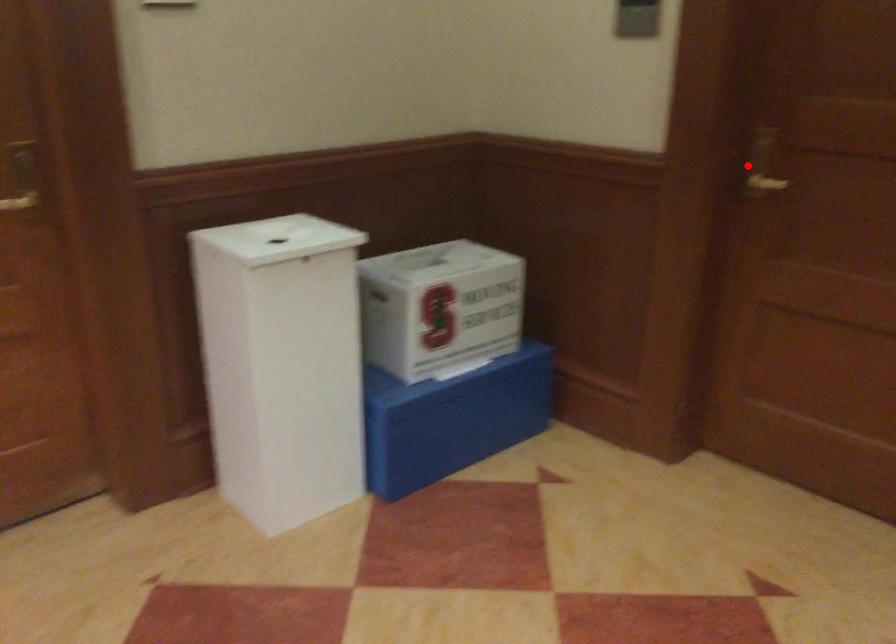
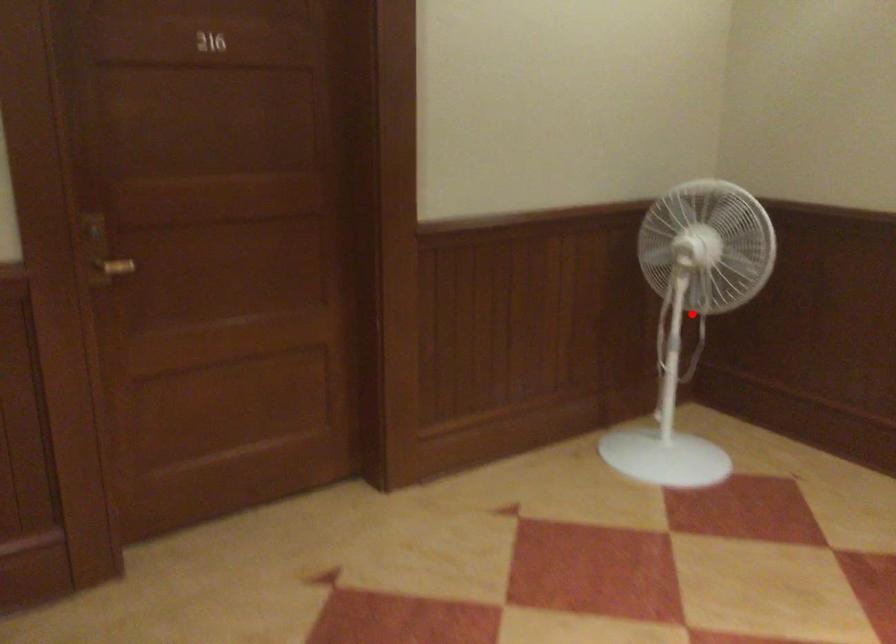
I am providing you with two images of the same scene from different viewpoints. A red point is marked on the first image and another point is marked on the second image. Is the marked point in image1 the same physical position as the marked point in image2?

No